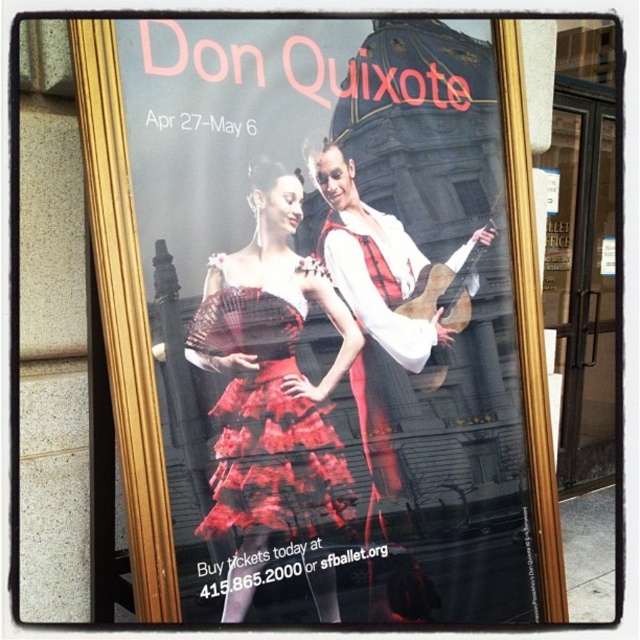
Is matte black violin at center to the right of red lace dress at center from the viewer's perspective?

Correct, you'll find matte black violin at center to the right of red lace dress at center.

Is point (392, 86) behind point (218, 448)?

Yes, point (392, 86) is behind point (218, 448).

The image size is (640, 640). I want to click on matte black violin at center, so click(332, 316).